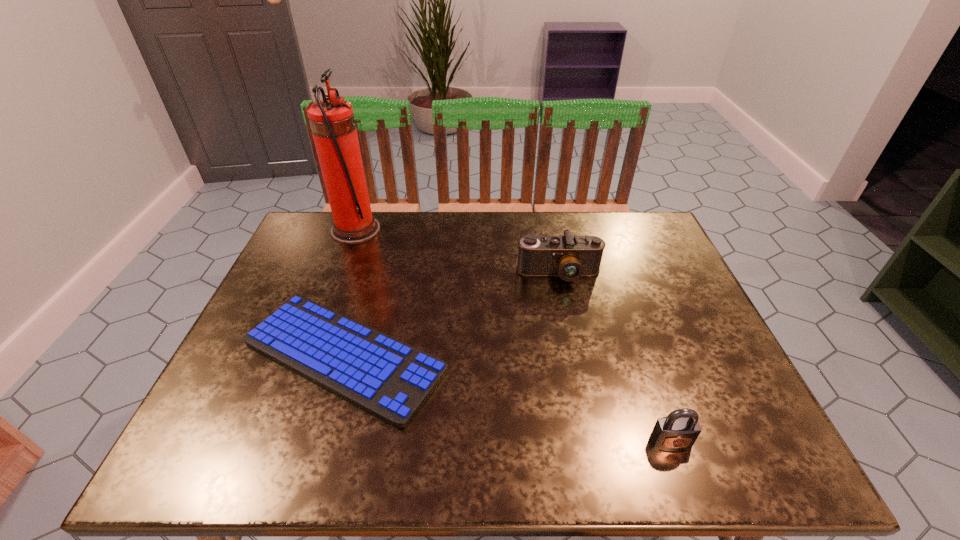
At what (x,y) coordinates should I click in order to perform the action: click on vacant space at the left edge of the desktop. Please return your answer as a coordinate pair (x, y). The image size is (960, 540). Looking at the image, I should click on (299, 278).

You are a GUI agent. You are given a task and a screenshot of the screen. Output one action in this format:
    pyautogui.click(x=<x>, y=<y>)
    Task: Click on the free region at the right edge of the desktop
    The image size is (960, 540).
    Given the screenshot: What is the action you would take?
    [652, 295]

The image size is (960, 540). What are the coordinates of `vacant area at the far left corner` in the screenshot? It's located at (321, 216).

Identify the location of vacant space at the near left corner of the desktop. (230, 436).

Where is `vacant space at the near right corner`? Image resolution: width=960 pixels, height=540 pixels. vacant space at the near right corner is located at coordinates (761, 429).

Find the location of a particular element. The height and width of the screenshot is (540, 960). free spot between the nearest object and the shortest object is located at coordinates (508, 399).

The image size is (960, 540). Identify the location of vacant point located between the second nearest object and the farthest object. (349, 293).

Locate an element on the screen. free spot between the farthest object and the computer keyboard is located at coordinates (349, 293).

The height and width of the screenshot is (540, 960). I want to click on vacant space that is in between the camera and the tallest object, so click(x=457, y=252).

I want to click on unoccupied area between the nearest object and the farthest object, so click(514, 335).